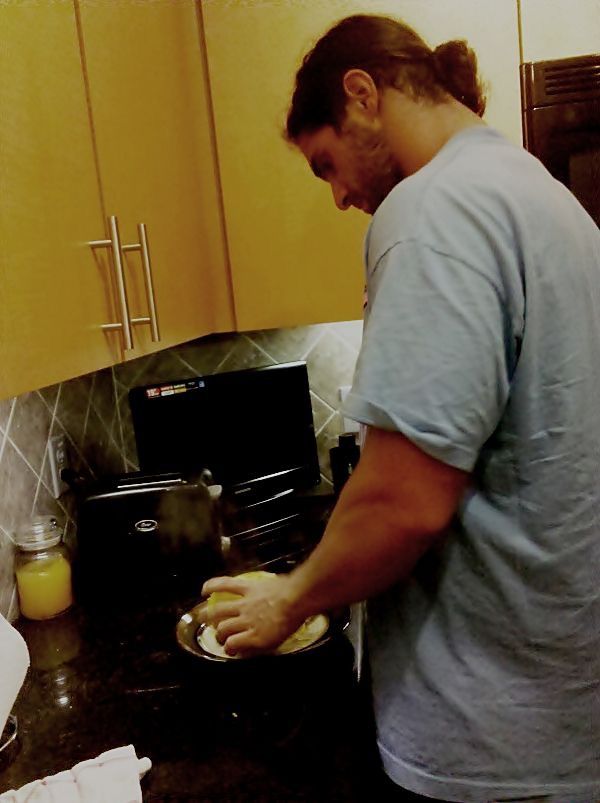
At what (x,y) coordinates should I click in order to perform the action: click on shelves. Please return your answer as a coordinate pair (x, y). The height and width of the screenshot is (803, 600). Looking at the image, I should click on (127, 182), (275, 190).